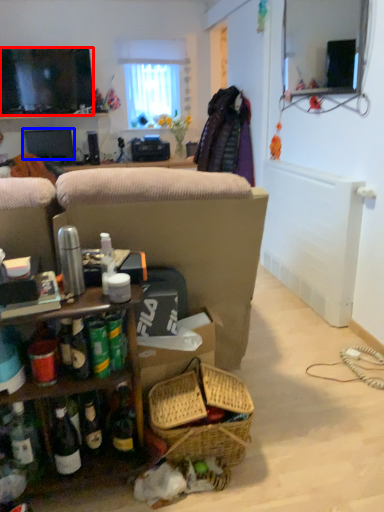
Question: Among these objects, which one is farthest to the camera, television (highlighted by a red box) or television (highlighted by a blue box)?

Choices:
 (A) television
 (B) television

Answer: (B)